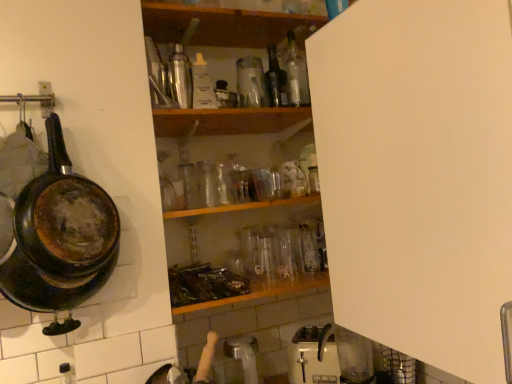
Question: From a real-world perspective, is transparent glass bottle at center, acting as the 4th bottle starting from the left, positioned over white matte cabinet at upper right based on gravity?

Choices:
 (A) no
 (B) yes

Answer: (B)

Question: Is white matte cabinet at upper right completely or partially inside transparent glass bottle at center, marked as the 2th bottle in a bottom-to-top arrangement?

Choices:
 (A) yes
 (B) no

Answer: (B)

Question: Is transparent glass bottle at center, which ranks as the 4th bottle in right-to-left order, oriented away from white matte cabinet at upper right?

Choices:
 (A) yes
 (B) no

Answer: (B)

Question: Could you tell me if transparent glass bottle at center, which ranks as the 4th bottle in right-to-left order, is turned towards white matte cabinet at upper right?

Choices:
 (A) yes
 (B) no

Answer: (B)

Question: Is transparent glass bottle at center, which ranks as the 4th bottle in right-to-left order, smaller than white matte cabinet at upper right?

Choices:
 (A) no
 (B) yes

Answer: (B)

Question: Looking at the image, does transparent glass bottle at upper center, which is the 1th bottle in right-to-left order, seem bigger or smaller compared to clear plastic bottle at center, which is counted as the third bottle, starting from the left?

Choices:
 (A) big
 (B) small

Answer: (A)

Question: Considering the positions of transparent glass bottle at upper center, which is counted as the seventh bottle, starting from the bottom, and clear plastic bottle at center, the 5th bottle when ordered from right to left, in the image, is transparent glass bottle at upper center, which is counted as the seventh bottle, starting from the bottom, wider or thinner than clear plastic bottle at center, the 5th bottle when ordered from right to left,?

Choices:
 (A) wide
 (B) thin

Answer: (B)

Question: From the image's perspective, relative to clear plastic bottle at center, the 5th bottle when ordered from right to left, is transparent glass bottle at upper center, which is the first bottle in top-to-bottom order, above or below?

Choices:
 (A) above
 (B) below

Answer: (A)

Question: Relative to clear plastic bottle at center, the 3th bottle ordered from the bottom, is transparent glass bottle at upper center, the seventh bottle when ordered from left to right, in front or behind?

Choices:
 (A) front
 (B) behind

Answer: (B)

Question: Does point (205, 102) appear closer or farther from the camera than point (334, 311)?

Choices:
 (A) farther
 (B) closer

Answer: (A)

Question: From a real-world perspective, is clear plastic bottle at center, the 5th bottle when ordered from right to left, above or below white matte cabinet at upper right?

Choices:
 (A) above
 (B) below

Answer: (A)

Question: Is clear plastic bottle at center, the 5th bottle when ordered from right to left, in front of or behind white matte cabinet at upper right in the image?

Choices:
 (A) front
 (B) behind

Answer: (B)

Question: Is clear plastic bottle at center, which is counted as the third bottle, starting from the left, spatially inside white matte cabinet at upper right, or outside of it?

Choices:
 (A) outside
 (B) inside

Answer: (A)

Question: Looking at the image, does brushed metal thermos at upper center, which ranks as the 4th bottle in bottom-to-top order, seem bigger or smaller compared to rusty cast iron frying pan at left?

Choices:
 (A) big
 (B) small

Answer: (B)

Question: Does point (186, 102) appear closer or farther from the camera than point (23, 268)?

Choices:
 (A) farther
 (B) closer

Answer: (A)